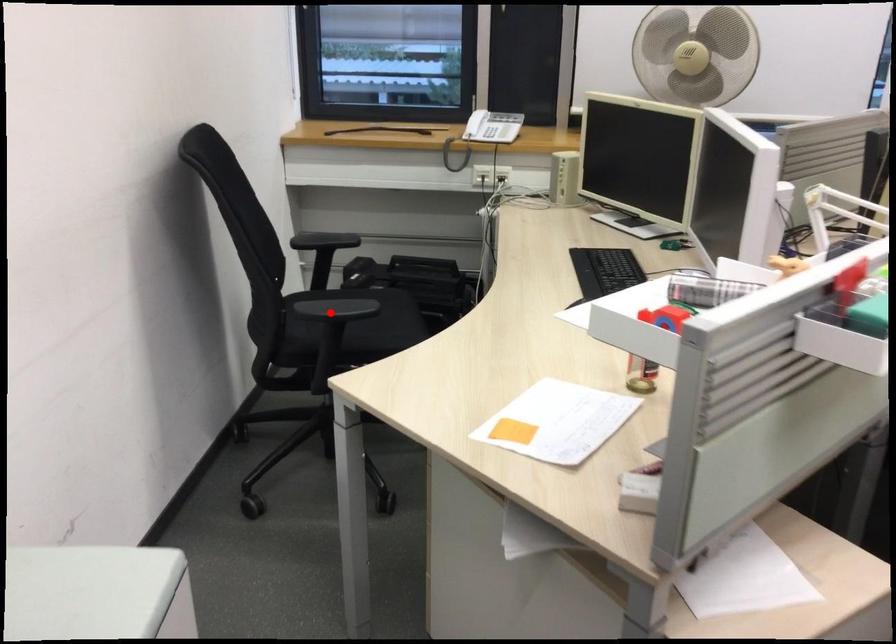
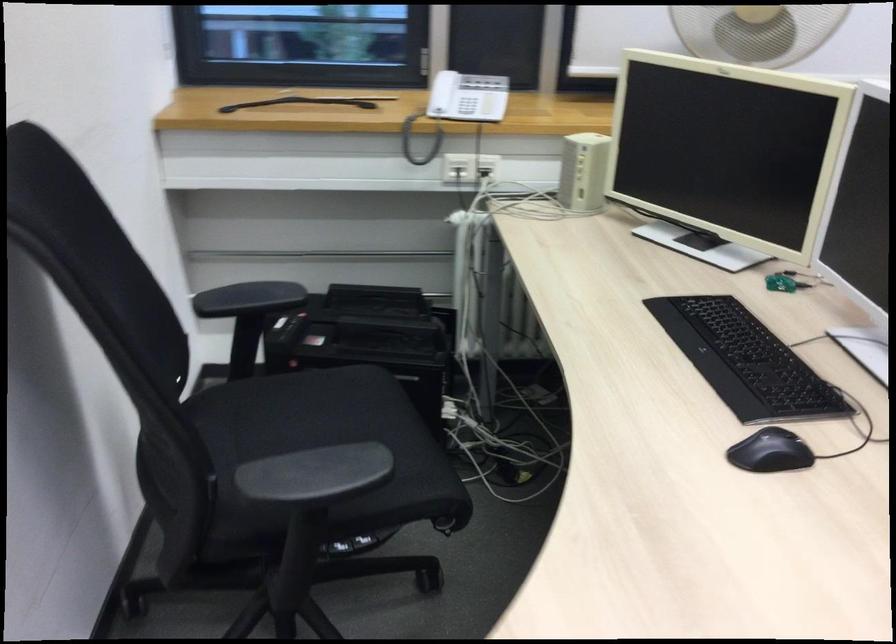
Question: I am providing you with two images of the same scene from different viewpoints. Given a red point in image1, look at the same physical point in image2. Is it:

Choices:
 (A) Closer to the viewpoint
 (B) Farther from the viewpoint

Answer: (A)